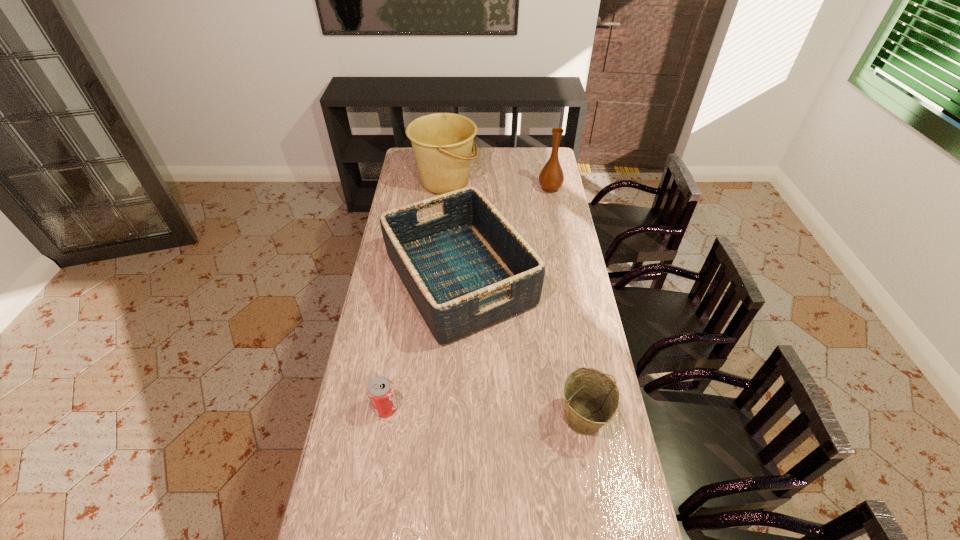
Where is `free region at the far right corner of the desktop`? free region at the far right corner of the desktop is located at coordinates (535, 164).

I want to click on empty space between the bucket and the vase, so click(x=497, y=185).

This screenshot has width=960, height=540. In order to click on vacant area that lies between the wine bucket and the vase in this screenshot , I will do `click(566, 303)`.

At what (x,y) coordinates should I click in order to perform the action: click on unoccupied area between the bucket and the vase. Please return your answer as a coordinate pair (x, y). The width and height of the screenshot is (960, 540). Looking at the image, I should click on (497, 185).

You are a GUI agent. You are given a task and a screenshot of the screen. Output one action in this format:
    pyautogui.click(x=<x>, y=<y>)
    Task: Click on the object that stands as the second closest to the shortest object
    The height and width of the screenshot is (540, 960).
    Given the screenshot: What is the action you would take?
    pyautogui.click(x=591, y=398)

Where is `object that can be found as the closest to the vase`? object that can be found as the closest to the vase is located at coordinates (466, 268).

I want to click on vacant space that satisfies the following two spatial constraints: 1. on the side of the third nearest object with the handle; 2. on the right side of the bucket, so click(x=436, y=279).

You are a GUI agent. You are given a task and a screenshot of the screen. Output one action in this format:
    pyautogui.click(x=<x>, y=<y>)
    Task: Click on the vacant space that satisfies the following two spatial constraints: 1. on the back side of the basket; 2. on the side of the bucket with the handle
    Image resolution: width=960 pixels, height=540 pixels.
    Given the screenshot: What is the action you would take?
    pyautogui.click(x=464, y=182)

Find the location of a particular element. vacant region that satisfies the following two spatial constraints: 1. on the side of the bucket with the handle; 2. on the back side of the vase is located at coordinates (444, 188).

I want to click on free spot that satisfies the following two spatial constraints: 1. on the side of the bucket with the handle; 2. on the left side of the vase, so click(x=444, y=188).